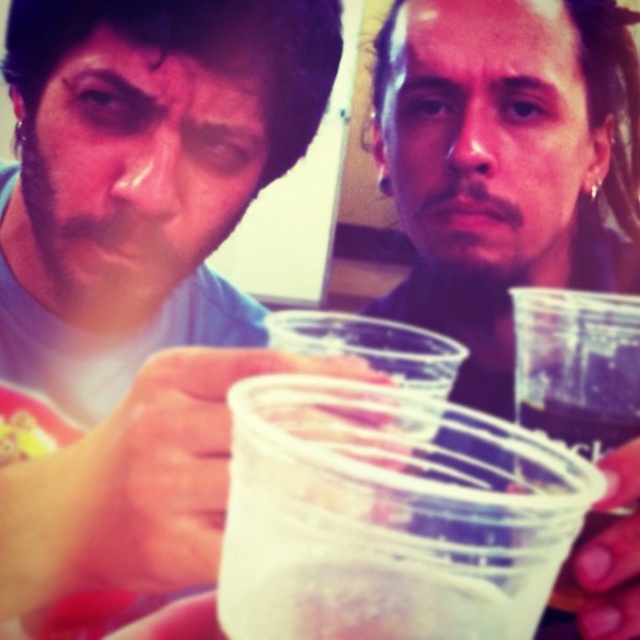
Question: Which object is positioned closest to the clear plastic cup at center?

Choices:
 (A) yellow matte food at lower left
 (B) translucent plastic cup at center

Answer: (B)

Question: Can you confirm if matte plastic cup at center is thinner than translucent plastic cup at center?

Choices:
 (A) yes
 (B) no

Answer: (B)

Question: Does matte plastic cup at center have a lesser width compared to translucent plastic cup at center?

Choices:
 (A) yes
 (B) no

Answer: (B)

Question: Can you confirm if matte plastic cup at center is bigger than translucent plastic cup at center?

Choices:
 (A) no
 (B) yes

Answer: (B)

Question: Which object is closer to the camera taking this photo?

Choices:
 (A) clear plastic cup at center
 (B) translucent plastic cup at center

Answer: (B)

Question: Which object is closer to the camera taking this photo?

Choices:
 (A) transparent plastic cup at center
 (B) clear plastic cup at center
 (C) yellow matte food at lower left

Answer: (A)